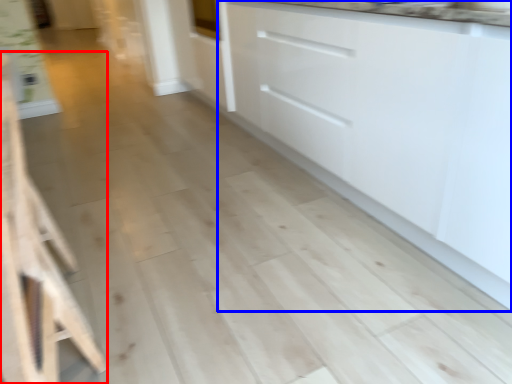
Question: Which point is closer to the camera, furniture (highlighted by a red box) or cabinetry (highlighted by a blue box)?

Choices:
 (A) furniture
 (B) cabinetry

Answer: (A)